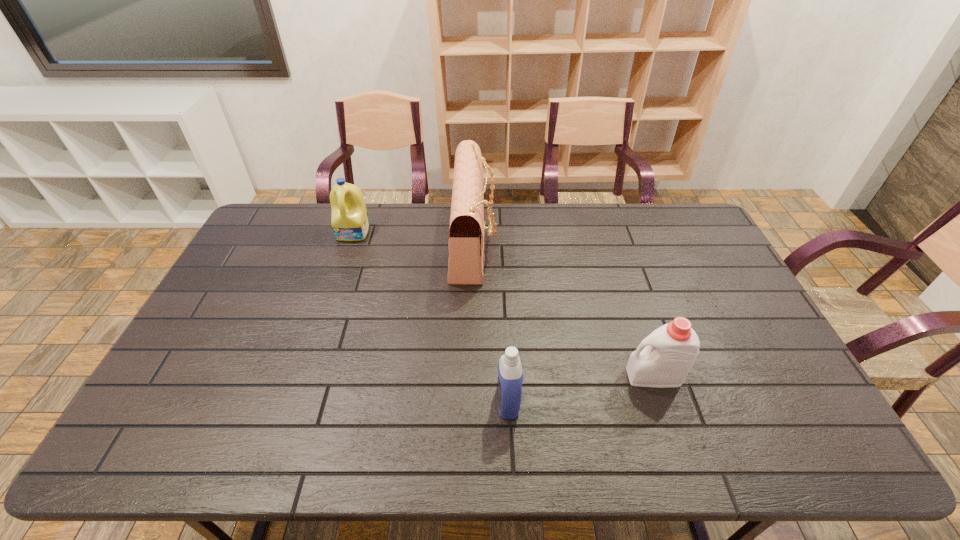
The height and width of the screenshot is (540, 960). Find the location of `vacant region located 0.050m on the right of the second detergent from right to left`. vacant region located 0.050m on the right of the second detergent from right to left is located at coordinates (539, 402).

The height and width of the screenshot is (540, 960). I want to click on handbag located in the far edge section of the desktop, so click(x=467, y=227).

At what (x,y) coordinates should I click in order to perform the action: click on detergent that is at the far edge. Please return your answer as a coordinate pair (x, y). The image size is (960, 540). Looking at the image, I should click on (349, 219).

The image size is (960, 540). What are the coordinates of `vacant space at the near edge of the desktop` in the screenshot? It's located at (336, 443).

In the image, there is a desktop. At what (x,y) coordinates should I click in order to perform the action: click on vacant space at the left edge. Please return your answer as a coordinate pair (x, y). This screenshot has width=960, height=540. Looking at the image, I should click on (204, 327).

Locate an element on the screen. This screenshot has height=540, width=960. free space at the right edge is located at coordinates (682, 262).

The image size is (960, 540). Find the location of `vacant space at the far left corner of the desktop`. vacant space at the far left corner of the desktop is located at coordinates (285, 220).

The image size is (960, 540). I want to click on vacant space that is in between the rightmost object and the tallest object, so click(564, 309).

Locate an element on the screen. empty space between the rightmost object and the tallest object is located at coordinates (564, 309).

Identify the location of vacant area between the farthest detergent and the rightmost object. (504, 304).